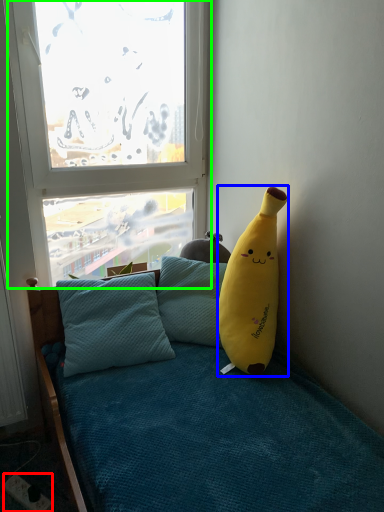
Question: Which is nearer to the power outlet (highlighted by a red box)? banana (highlighted by a blue box) or window (highlighted by a green box).

Choices:
 (A) banana
 (B) window

Answer: (A)